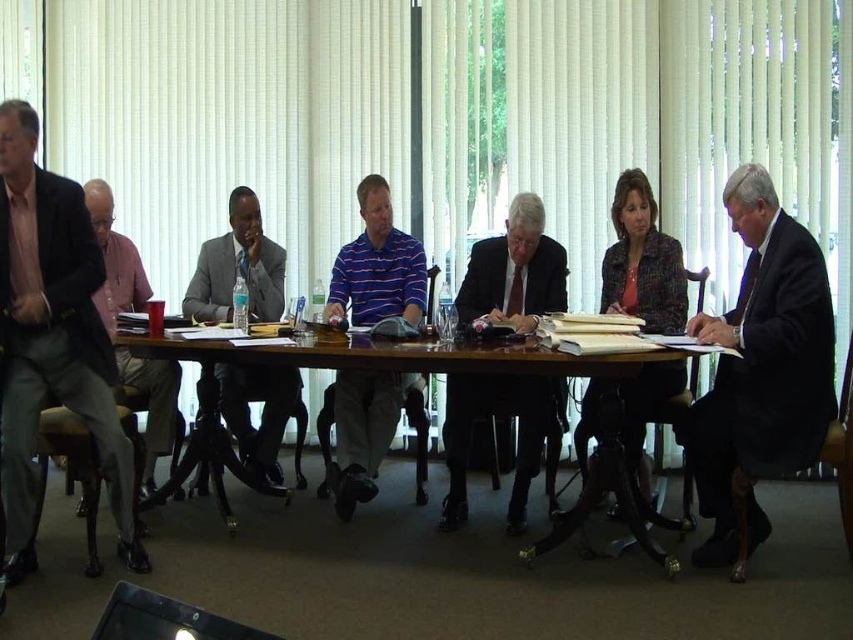
What do you see at coordinates (376, 266) in the screenshot?
I see `blue striped polo shirt at center` at bounding box center [376, 266].

Identify the location of blue striped polo shirt at center. (376, 266).

You are a GUI agent. You are given a task and a screenshot of the screen. Output one action in this format:
    pyautogui.click(x=<x>, y=<y>)
    Task: Click on the blue striped polo shirt at center
    The height and width of the screenshot is (640, 853).
    Given the screenshot: What is the action you would take?
    coord(376,266)

Find the location of a particular element. This screenshot has height=640, width=853. light brown suit at left is located at coordinates (51, 337).

Image resolution: width=853 pixels, height=640 pixels. Describe the element at coordinates (51, 337) in the screenshot. I see `light brown suit at left` at that location.

At what (x,y) coordinates should I click in order to perform the action: click on light brown suit at left. Please return your answer as a coordinate pair (x, y). The image size is (853, 640). Looking at the image, I should click on (51, 337).

Can you confirm if gray suit at center is positioned above patterned fabric blazer at center?

Indeed, gray suit at center is positioned over patterned fabric blazer at center.

Is gray suit at center below patterned fabric blazer at center?

Actually, gray suit at center is above patterned fabric blazer at center.

Locate an element on the screen. The image size is (853, 640). gray suit at center is located at coordinates (236, 268).